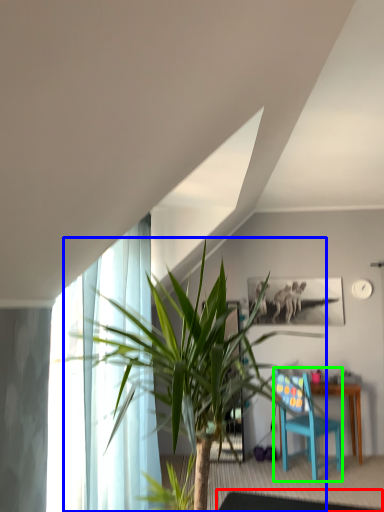
Question: Which object is positioned farthest from glass table (highlighted by a red box)? Select from houseplant (highlighted by a blue box) and chair (highlighted by a green box).

Choices:
 (A) houseplant
 (B) chair

Answer: (A)